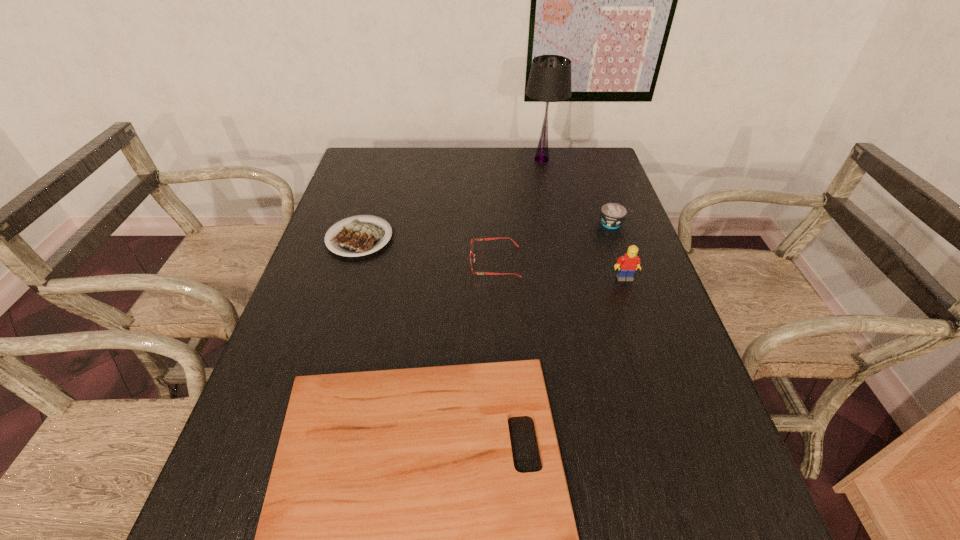
At what (x,y) coordinates should I click in order to perform the action: click on object positioned at the far right corner. Please return your answer as a coordinate pair (x, y). Looking at the image, I should click on pyautogui.click(x=550, y=76).

The image size is (960, 540). I want to click on free location at the far edge, so click(x=445, y=151).

In the image, there is a desktop. At what (x,y) coordinates should I click in order to perform the action: click on free space at the left edge. Please return your answer as a coordinate pair (x, y). This screenshot has height=540, width=960. Looking at the image, I should click on (311, 289).

Locate an element on the screen. free space at the right edge of the desktop is located at coordinates (668, 449).

Image resolution: width=960 pixels, height=540 pixels. In order to click on vacant space at the far left corner of the desktop in this screenshot , I will do tap(373, 177).

In the image, there is a desktop. Identify the location of free space at the far right corner. pos(593,166).

Find the location of a particular element. Image resolution: width=960 pixels, height=540 pixels. free spot between the yogurt and the Lego is located at coordinates (619, 251).

In order to click on vacant region between the spectacles and the lampshade in this screenshot , I will do `click(518, 211)`.

Identify the location of empty space that is in between the fifth tallest object and the lampshade. (450, 199).

Locate an element on the screen. This screenshot has height=540, width=960. object that ranks as the second closest to the third tallest object is located at coordinates (482, 239).